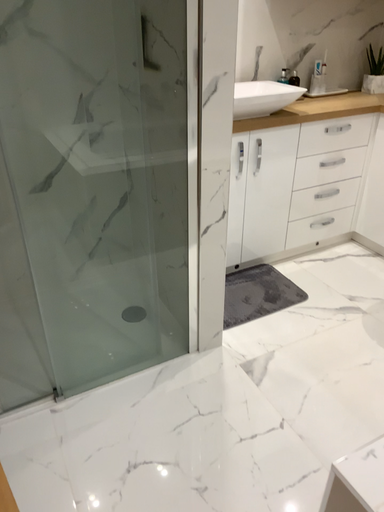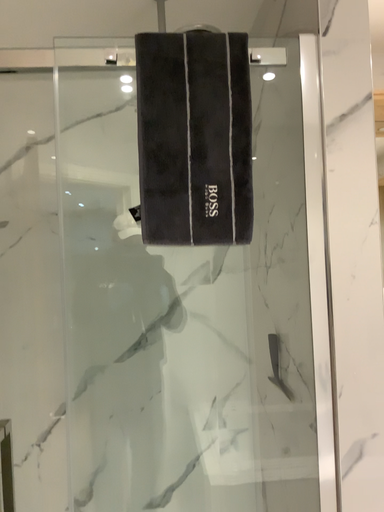
Question: How did the camera likely rotate when shooting the video?

Choices:
 (A) rotated downward
 (B) rotated upward

Answer: (B)